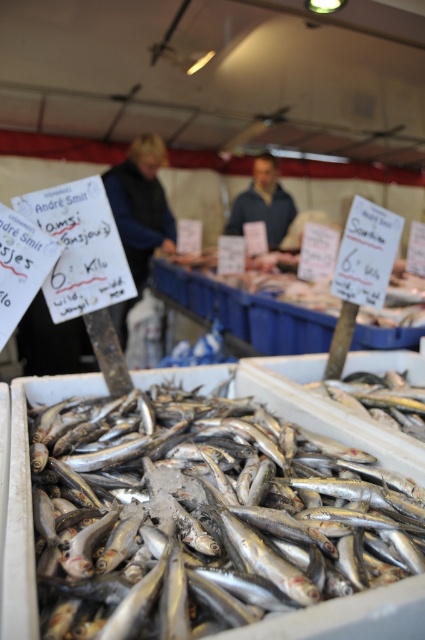
Question: Is silvery metallic fish at center further to camera compared to shiny silver fish at center?

Choices:
 (A) yes
 (B) no

Answer: (B)

Question: Can you confirm if silvery metallic fish at center is smaller than shiny silver fish at center?

Choices:
 (A) yes
 (B) no

Answer: (B)

Question: Can you confirm if silvery metallic fish at center is positioned below shiny silver fish at center?

Choices:
 (A) no
 (B) yes

Answer: (B)